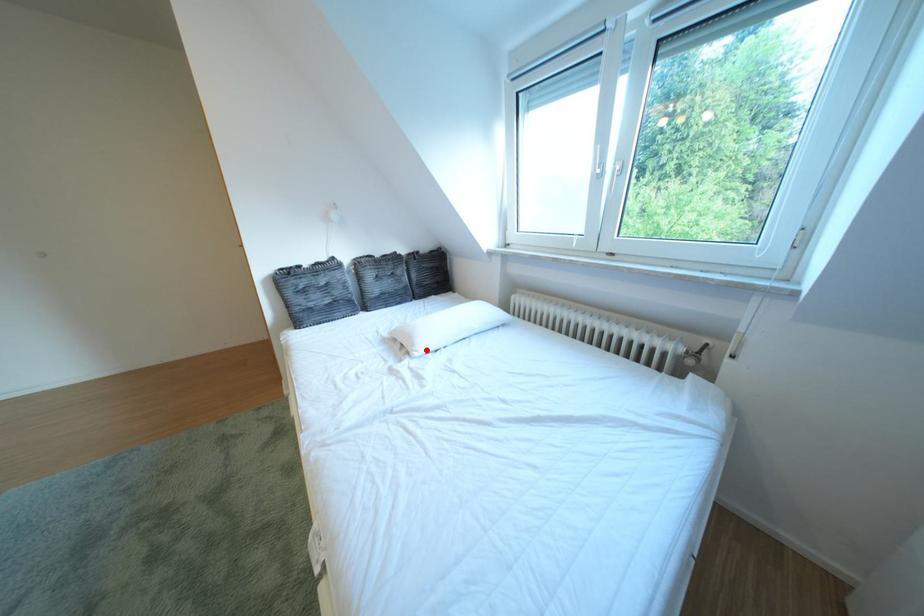
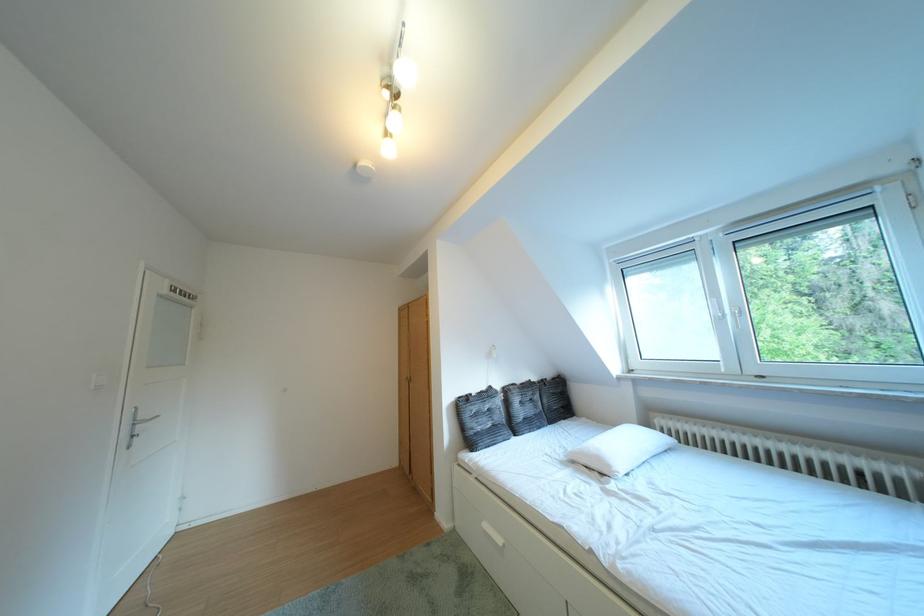
Question: I am providing you with two images of the same scene from different viewpoints. Image1 has a red point marked. In image2, the corresponding 3D location appears at what relative position? Reply with the corresponding letter.

Choices:
 (A) Closer
 (B) Farther

Answer: (B)